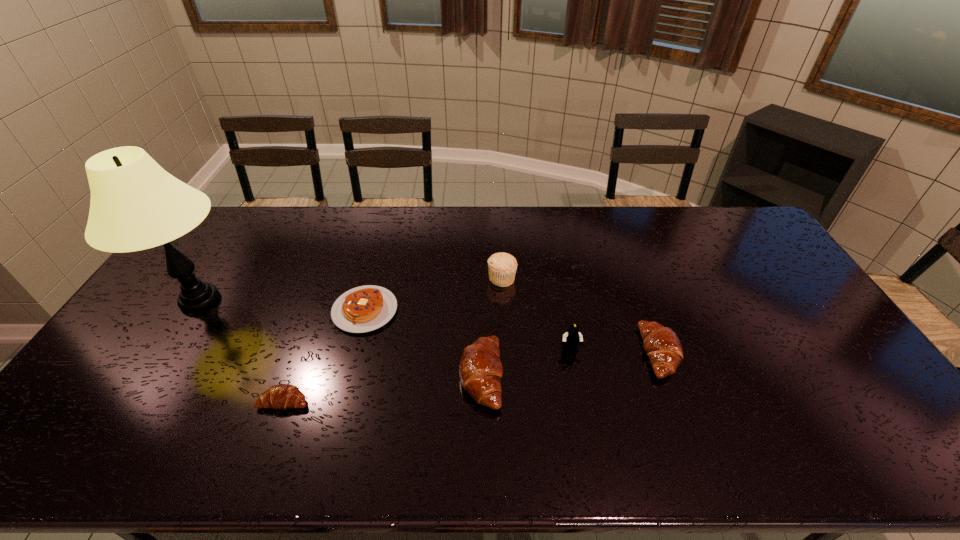
Where is `free region located on the left of the second crescent roll from left to right`? This screenshot has height=540, width=960. free region located on the left of the second crescent roll from left to right is located at coordinates (347, 375).

Image resolution: width=960 pixels, height=540 pixels. What are the coordinates of `free spot located 0.340m on the right of the second tallest crescent roll` in the screenshot? It's located at 800,353.

In order to click on vacant position located on the right of the leftmost object in this screenshot , I will do (x=336, y=300).

What are the coordinates of `free spot located 0.230m on the back of the muffin` in the screenshot? It's located at (499, 227).

I want to click on blank area located 0.050m on the front-facing side of the sixth object from left to right, so click(x=574, y=370).

Where is `vacant space located 0.240m on the right of the pancake`? The image size is (960, 540). vacant space located 0.240m on the right of the pancake is located at coordinates (476, 310).

You are a GUI agent. You are given a task and a screenshot of the screen. Output one action in this format:
    pyautogui.click(x=<x>, y=<y>)
    Task: Click on the object that is at the left edge
    This screenshot has height=540, width=960.
    Given the screenshot: What is the action you would take?
    pyautogui.click(x=135, y=205)

What are the coordinates of `free space at the far edge of the desktop` in the screenshot? It's located at (273, 234).

Find the location of `blank space at the near edge`. blank space at the near edge is located at coordinates (575, 407).

I want to click on free space at the left edge, so click(x=149, y=333).